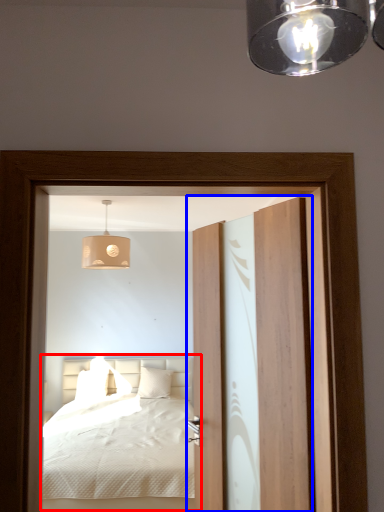
Question: Which point is further to the camera, bed (highlighted by a red box) or door (highlighted by a blue box)?

Choices:
 (A) bed
 (B) door

Answer: (A)